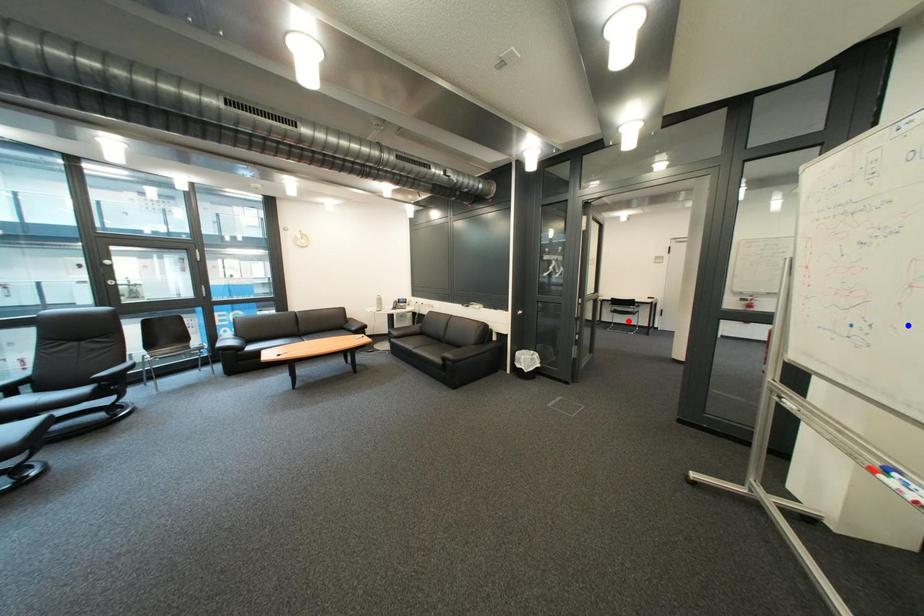
Question: Which of the two points in the image is closer to the camera?

Choices:
 (A) Blue point is closer.
 (B) Red point is closer.

Answer: (A)